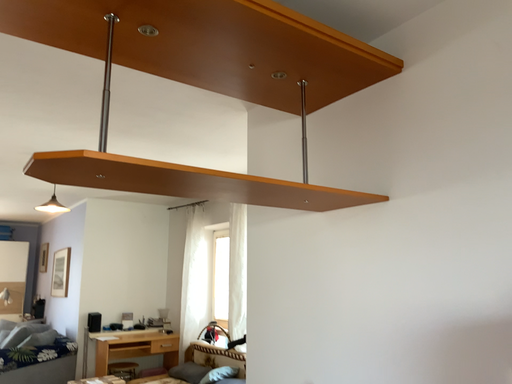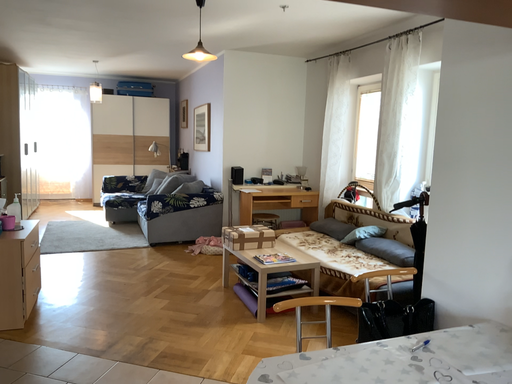
Question: How did the camera likely rotate when shooting the video?

Choices:
 (A) rotated downward
 (B) rotated upward

Answer: (A)